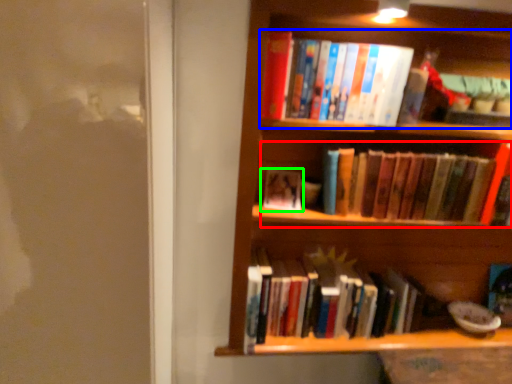
Question: Which is farther away from book (highlighted by a red box)? book (highlighted by a blue box) or book (highlighted by a green box)?

Choices:
 (A) book
 (B) book

Answer: (B)